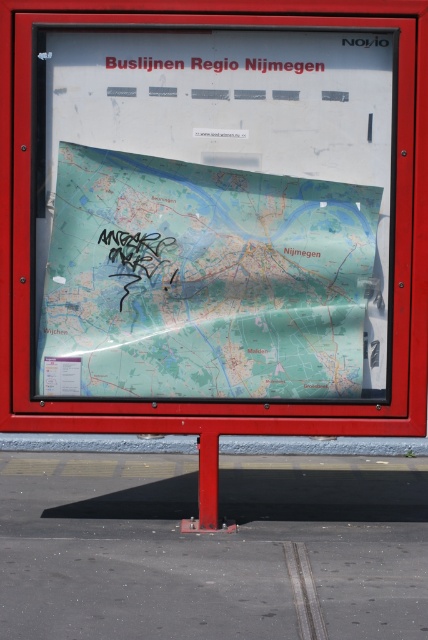
Question: Does transparent plastic map at center come in front of black paper at upper center?

Choices:
 (A) yes
 (B) no

Answer: (B)

Question: Among these points, which one is farthest from the camera?

Choices:
 (A) (282, 221)
 (B) (160, 64)

Answer: (A)

Question: Which of the following is the farthest from the observer?

Choices:
 (A) transparent plastic map at center
 (B) black paper at upper center

Answer: (A)

Question: Considering the relative positions of transparent plastic map at center and black paper at upper center in the image provided, where is transparent plastic map at center located with respect to black paper at upper center?

Choices:
 (A) above
 (B) below

Answer: (B)

Question: Is transparent plastic map at center further to camera compared to black paper at upper center?

Choices:
 (A) yes
 (B) no

Answer: (A)